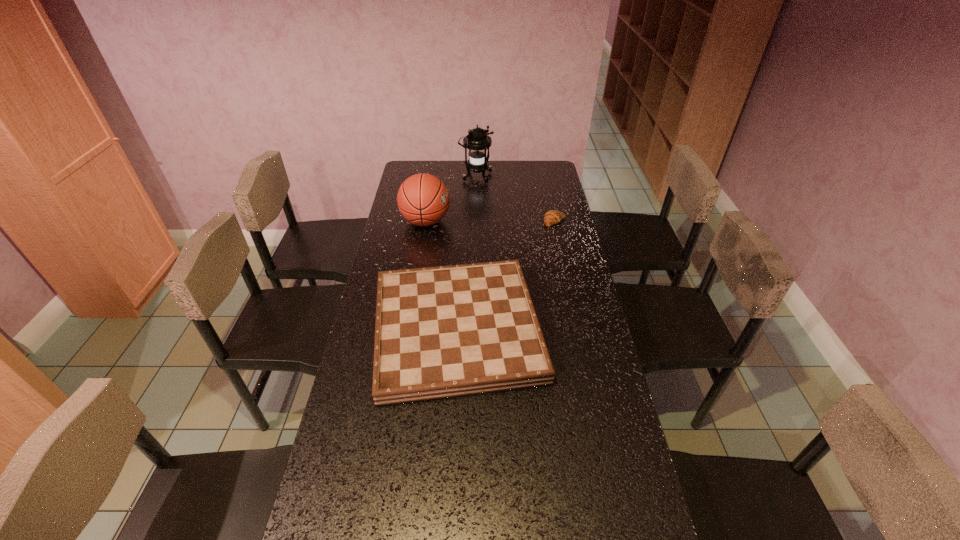
Where is `empty space between the tallest object and the second tallest object`? The height and width of the screenshot is (540, 960). empty space between the tallest object and the second tallest object is located at coordinates (451, 199).

I want to click on vacant space in between the shortest object and the lantern, so click(516, 199).

This screenshot has width=960, height=540. I want to click on vacant region between the second shortest object and the tallest object, so click(x=467, y=254).

Identify which object is the third closest to the crescent roll. Please provide its 2D coordinates. Your answer should be formatted as a tuple, i.e. [(x, y)], where the tuple contains the x and y coordinates of a point satisfying the conditions above.

[(423, 199)]

Where is `the second closest object to the basketball`? This screenshot has height=540, width=960. the second closest object to the basketball is located at coordinates (442, 332).

Locate an element on the screen. This screenshot has width=960, height=540. free spot that satisfies the following two spatial constraints: 1. on the back side of the nearest object; 2. on the right side of the farthest object is located at coordinates (465, 177).

Where is `free space that satisfies the following two spatial constraints: 1. on the front side of the crescent roll; 2. on the right side of the tallest object`? The width and height of the screenshot is (960, 540). free space that satisfies the following two spatial constraints: 1. on the front side of the crescent roll; 2. on the right side of the tallest object is located at coordinates (475, 221).

The height and width of the screenshot is (540, 960). What are the coordinates of `vacant space that satisfies the following two spatial constraints: 1. on the logo side of the basketball; 2. on the back side of the third tallest object` in the screenshot? It's located at click(408, 330).